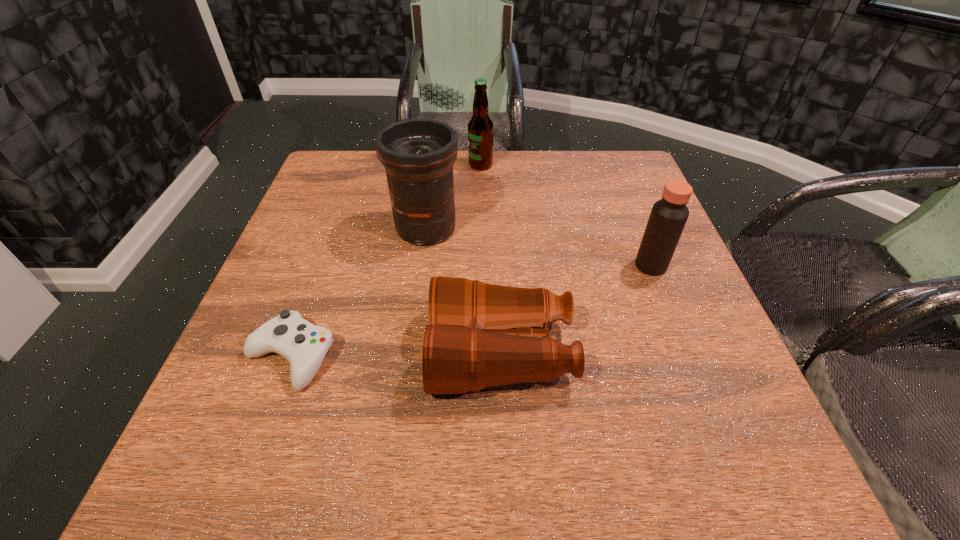
In order to click on free space located on the back of the telephoto lens in this screenshot , I will do (432, 188).

Where is `free space located on the left of the rightmost object`? Image resolution: width=960 pixels, height=540 pixels. free space located on the left of the rightmost object is located at coordinates (497, 266).

Identify the location of vacant space located 0.250m through the lenses of the binoculars. The image size is (960, 540). (294, 353).

This screenshot has width=960, height=540. What are the coordinates of `free space located through the lenses of the binoculars` in the screenshot? It's located at (394, 353).

You are a GUI agent. You are given a task and a screenshot of the screen. Output one action in this format:
    pyautogui.click(x=<x>, y=<y>)
    Task: Click on the vacant space located 0.230m through the lenses of the binoculars
    This screenshot has width=960, height=540.
    Given the screenshot: What is the action you would take?
    pyautogui.click(x=305, y=353)

You are a GUI agent. You are given a task and a screenshot of the screen. Output one action in this format:
    pyautogui.click(x=<x>, y=<y>)
    Task: Click on the vacant space situated on the back of the shortest object
    The image size is (960, 540).
    Given the screenshot: What is the action you would take?
    pyautogui.click(x=323, y=270)

Where is `object at the far edge`? object at the far edge is located at coordinates (480, 126).

Locate an element on the screen. The image size is (960, 540). object at the left edge is located at coordinates (304, 345).

Locate an element on the screen. This screenshot has height=540, width=960. object present at the right edge is located at coordinates (668, 216).

The image size is (960, 540). In the image, there is a desktop. Identify the location of vacant space at the far edge. (477, 172).